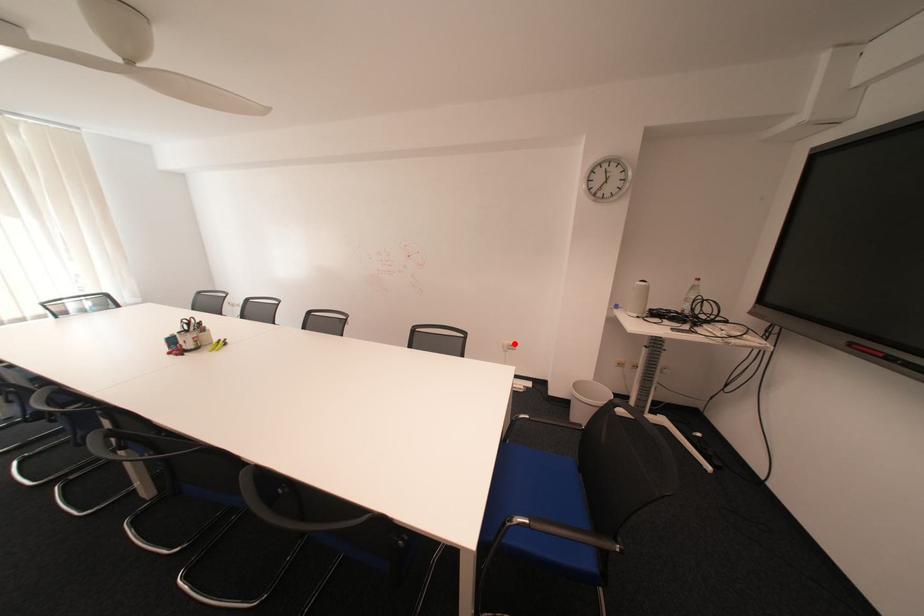
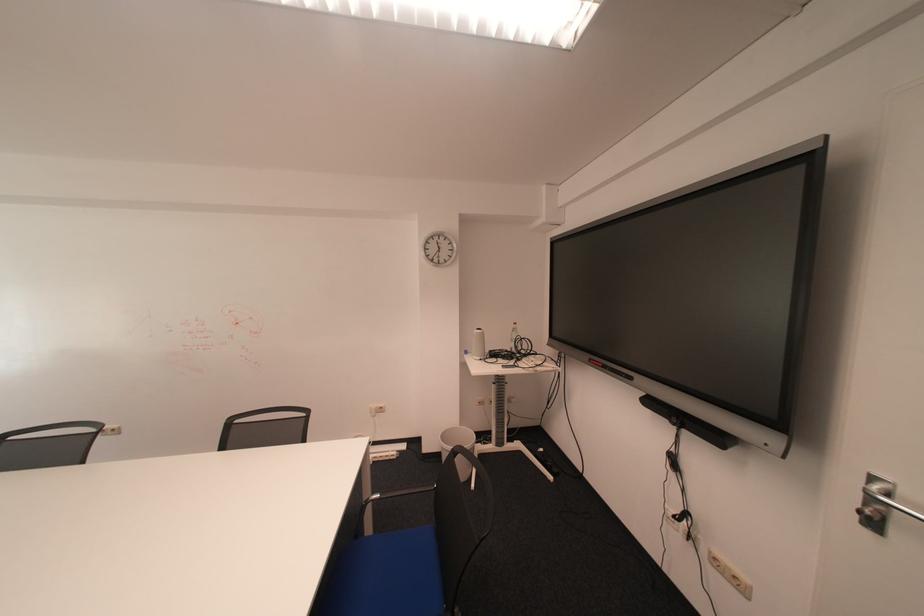
Locate, in the second image, the point that corresponds to the highlighted location in the first image.

(382, 408)